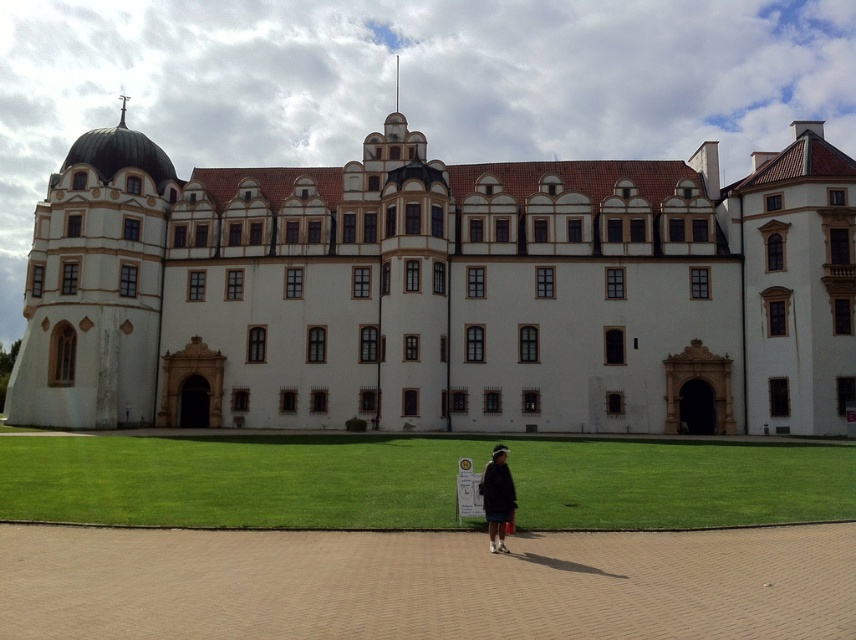
You are a tourist visiting this historic site and want to take a photo of the white stone building at center and the dark gray sweater at center. Which object should you focus on first to ensure it fits entirely in your camera frame?

The dark gray sweater at center should be focused on first because it is smaller than the white stone building at center, so capturing it properly ensures the larger building will also fit in the frame.

You are a drone operator and need to fly your drone from the green grass at lower center to the white stone building at center. Considering the height difference between them, will your drone need to ascend significantly to reach the building?

The white stone building at center is much taller than the green grass at lower center, so yes, the drone will need to ascend significantly to reach the building.

You are standing at the entrance of the grand historic building and want to place a decorative fountain exactly at the center of the green grass at lower center. According to the coordinates provided, where should you place the fountain?

The fountain should be placed at the coordinates point (x=235, y=480) where the green grass at lower center is located.